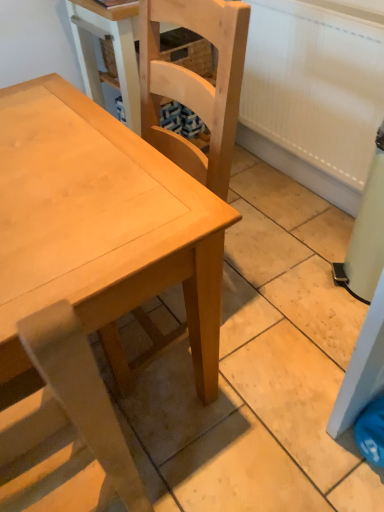
Question: Is natural wood chair at center, which appears as the second chair when ordered from the bottom, touching light brown wood chair at center, which is the first chair in bottom-to-top order?

Choices:
 (A) no
 (B) yes

Answer: (A)

Question: From a real-world perspective, is natural wood chair at center, the first chair viewed from the top, over light brown wood chair at center, which is counted as the 2th chair, starting from the top?

Choices:
 (A) yes
 (B) no

Answer: (A)

Question: From the image's perspective, is natural wood chair at center, which appears as the second chair when ordered from the bottom, above light brown wood chair at center, which is the first chair in bottom-to-top order?

Choices:
 (A) no
 (B) yes

Answer: (B)

Question: Is light brown wood chair at center, which is counted as the 2th chair, starting from the top, located within natural wood chair at center, the first chair viewed from the top?

Choices:
 (A) yes
 (B) no

Answer: (B)

Question: From the image's perspective, is natural wood chair at center, which appears as the second chair when ordered from the bottom, under light brown wood chair at center, which is the first chair in bottom-to-top order?

Choices:
 (A) no
 (B) yes

Answer: (A)

Question: Is natural wood chair at center, the first chair viewed from the top, positioned with its back to light brown wood chair at center, which is the first chair in bottom-to-top order?

Choices:
 (A) yes
 (B) no

Answer: (B)

Question: Is natural wood chair at center, which appears as the second chair when ordered from the bottom, facing towards light wood table at center?

Choices:
 (A) no
 (B) yes

Answer: (B)

Question: Is the position of natural wood chair at center, which appears as the second chair when ordered from the bottom, less distant than that of light wood table at center?

Choices:
 (A) yes
 (B) no

Answer: (B)

Question: Considering the relative sizes of natural wood chair at center, which appears as the second chair when ordered from the bottom, and light wood table at center in the image provided, is natural wood chair at center, which appears as the second chair when ordered from the bottom, bigger than light wood table at center?

Choices:
 (A) yes
 (B) no

Answer: (B)

Question: Is natural wood chair at center, the first chair viewed from the top, surrounding light wood table at center?

Choices:
 (A) yes
 (B) no

Answer: (B)

Question: Is natural wood chair at center, the first chair viewed from the top, shorter than light wood table at center?

Choices:
 (A) no
 (B) yes

Answer: (A)

Question: Is natural wood chair at center, the first chair viewed from the top, wider than light wood table at center?

Choices:
 (A) no
 (B) yes

Answer: (A)

Question: Is light brown wood chair at center, which is the first chair in bottom-to-top order, not inside natural wood chair at center, the first chair viewed from the top?

Choices:
 (A) yes
 (B) no

Answer: (A)